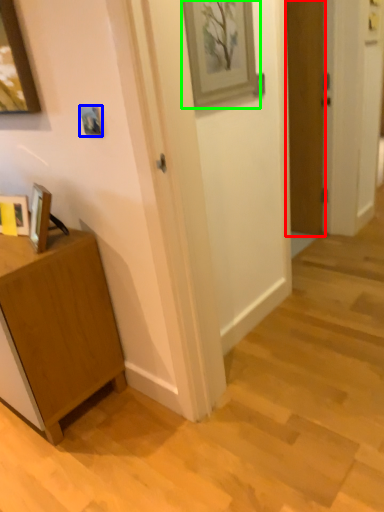
Question: Which is nearer to the door (highlighted by a red box)? picture frame (highlighted by a blue box) or picture frame (highlighted by a green box).

Choices:
 (A) picture frame
 (B) picture frame

Answer: (B)